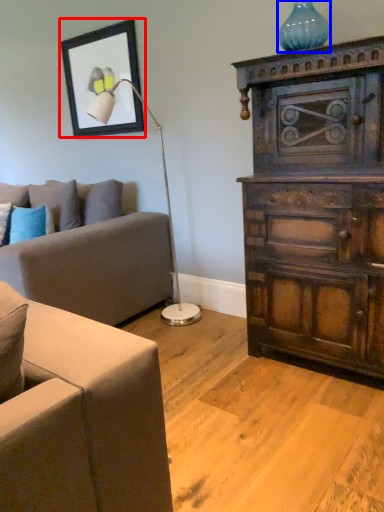
Question: Among these objects, which one is nearest to the camera, picture frame (highlighted by a red box) or vase (highlighted by a blue box)?

Choices:
 (A) picture frame
 (B) vase

Answer: (B)